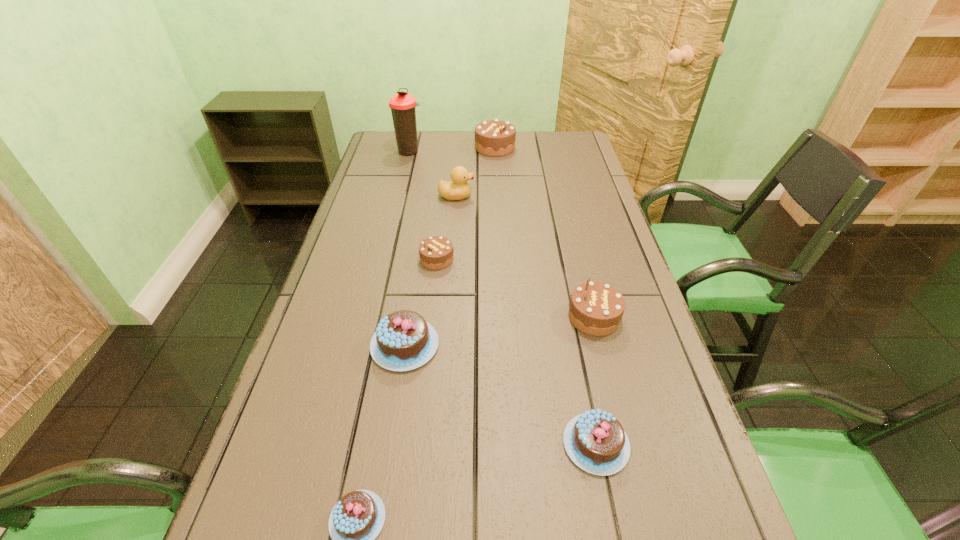
Find the location of a particular element. This screenshot has width=960, height=540. chocolate cake that is the fourth closest to the biggest pink chocolate cake is located at coordinates (596, 308).

Select which chocolate cake is the second closest to the brown thermos bottle. Please provide its 2D coordinates. Your answer should be formatted as a tuple, i.e. [(x, y)], where the tuple contains the x and y coordinates of a point satisfying the conditions above.

[(436, 252)]

Locate an element on the screen. the second closest brown chocolate cake to the sixth nearest object is located at coordinates (436, 252).

Locate an element on the screen. The image size is (960, 540). brown chocolate cake that can be found as the second closest to the fourth farthest object is located at coordinates (495, 138).

At what (x,y) coordinates should I click in order to perform the action: click on pink chocolate cake that stands as the closest to the biggest brown chocolate cake. Please return your answer as a coordinate pair (x, y). Looking at the image, I should click on (403, 341).

Locate an element on the screen. the second closest pink chocolate cake to the nearest chocolate cake is located at coordinates (595, 441).

Find the location of a particular element. The width and height of the screenshot is (960, 540). vacant space that satisfies the following two spatial constraints: 1. on the front side of the third chocolate cake from right to left; 2. facing forward on the duckling is located at coordinates (497, 196).

This screenshot has width=960, height=540. Identify the location of free location that satisfies the following two spatial constraints: 1. on the back side of the fifth nearest object; 2. on the left side of the biggest pink chocolate cake. (419, 259).

The height and width of the screenshot is (540, 960). What are the coordinates of `vacant region that satisfies the following two spatial constraints: 1. on the front side of the smallest brown chocolate cake; 2. on the right side of the second nearest object` in the screenshot? It's located at pyautogui.click(x=417, y=444).